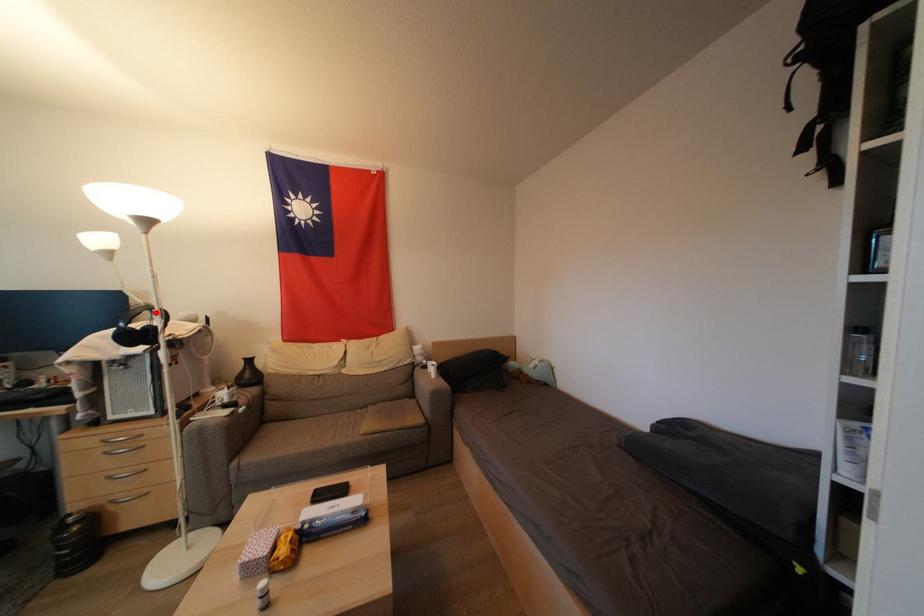
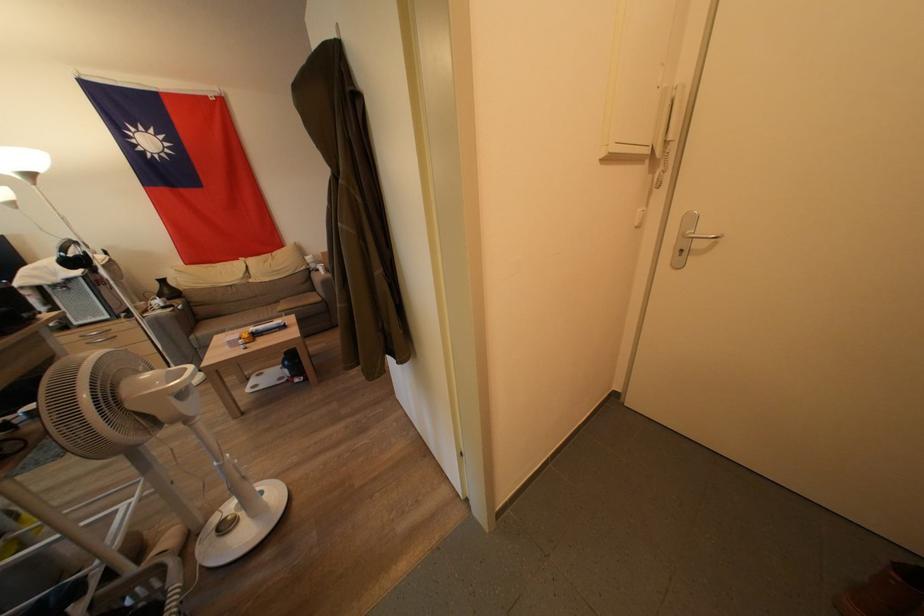
Question: I am providing you with two images of the same scene from different viewpoints. A red point is shown in image1. For the corresponding object point in image2, is it positioned nearer or farther from the camera?

Choices:
 (A) Nearer
 (B) Farther

Answer: (B)